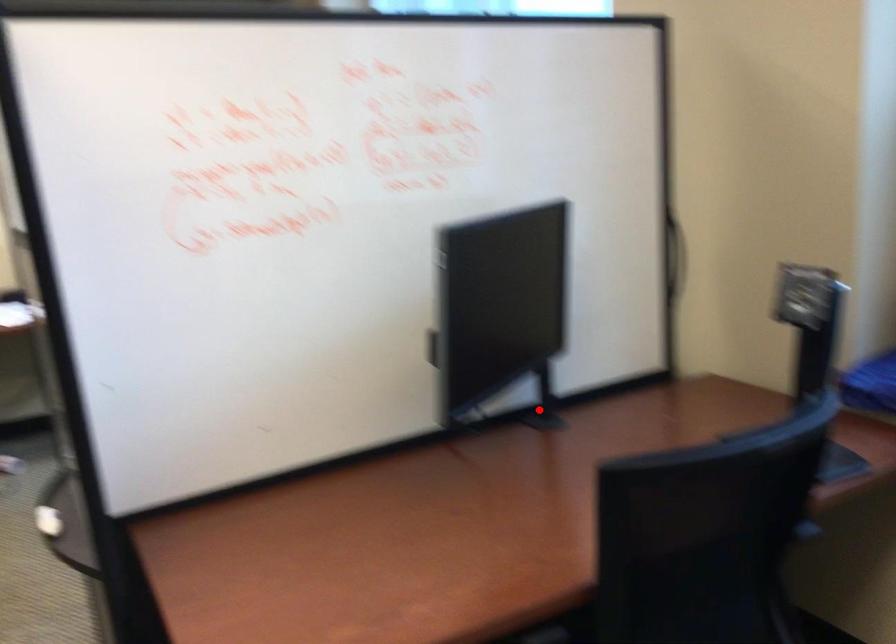
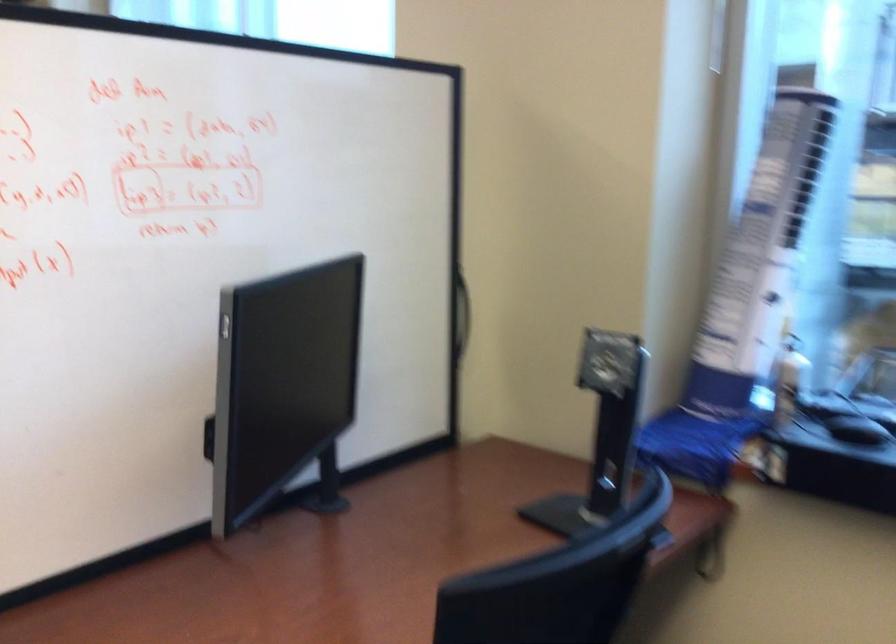
In the second image, find the point that corresponds to the highlighted location in the first image.

(325, 487)